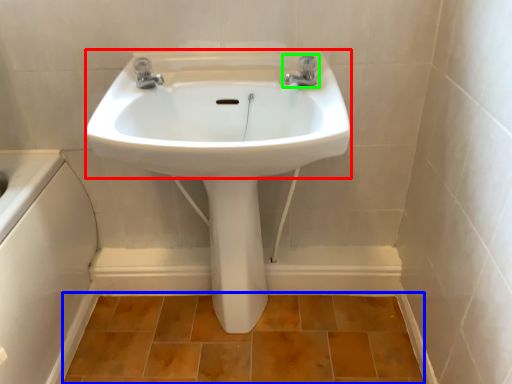
Question: Based on their relative distances, which object is nearer to sink (highlighted by a red box)? Choose from ceramic tile (highlighted by a blue box) and tap (highlighted by a green box).

Choices:
 (A) ceramic tile
 (B) tap

Answer: (B)